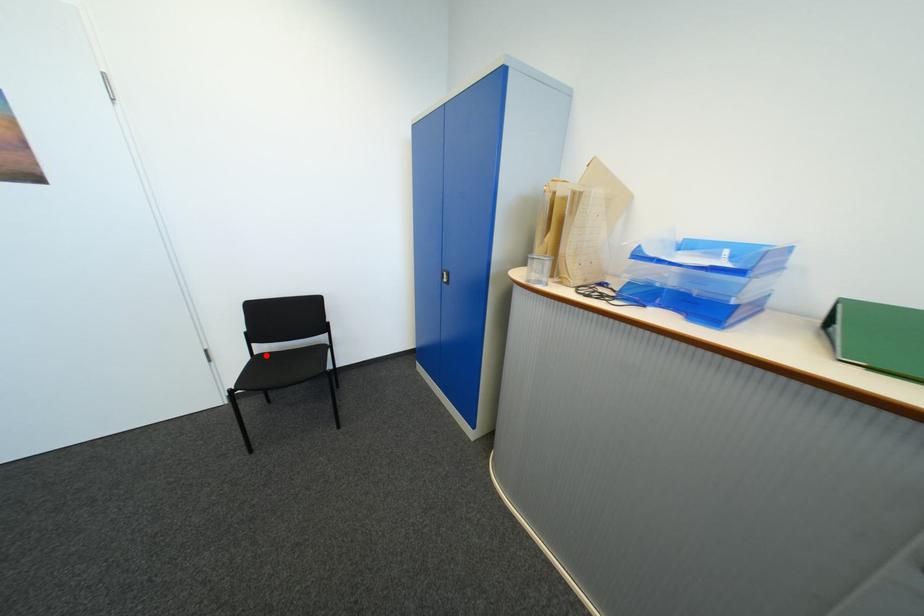
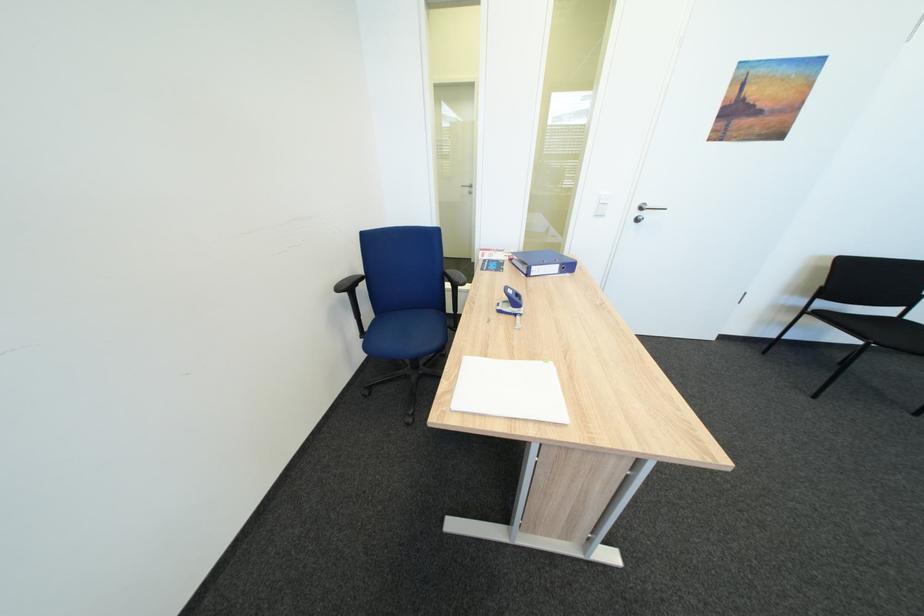
The point at the highlighted location is marked in the first image. Where is the corresponding point in the second image?

(819, 310)